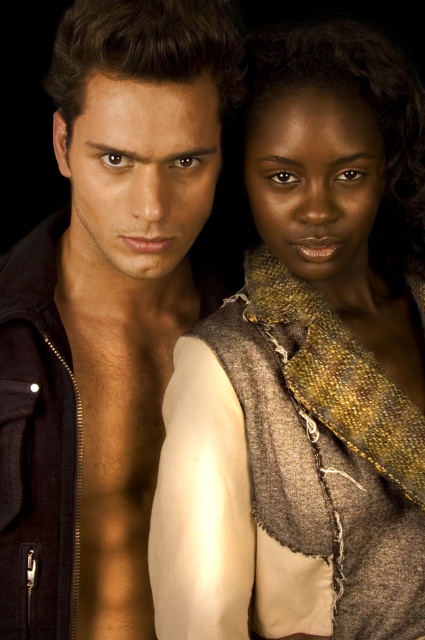
You are a photographer trying to capture the scene. You notice a point at coordinates (306, 368) in the image. Based on the description, what object is located at this point?

The point at coordinates (306, 368) is located on the textured brown scarf at center.

Consider the image. You are a fashion designer trying to create a new outfit combination. You have the textured brown scarf at center and the matte black jacket at left. Which item has a greater width when laid flat?

The textured brown scarf at center might be wider than matte black jacket at left.